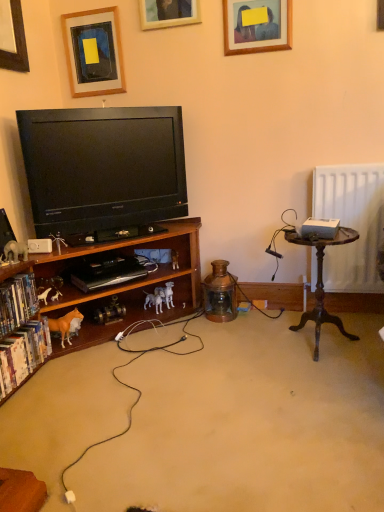
In order to click on free point in front of white plastic dog at lower center, which is the first toy in back-to-front order in this screenshot , I will do `click(153, 329)`.